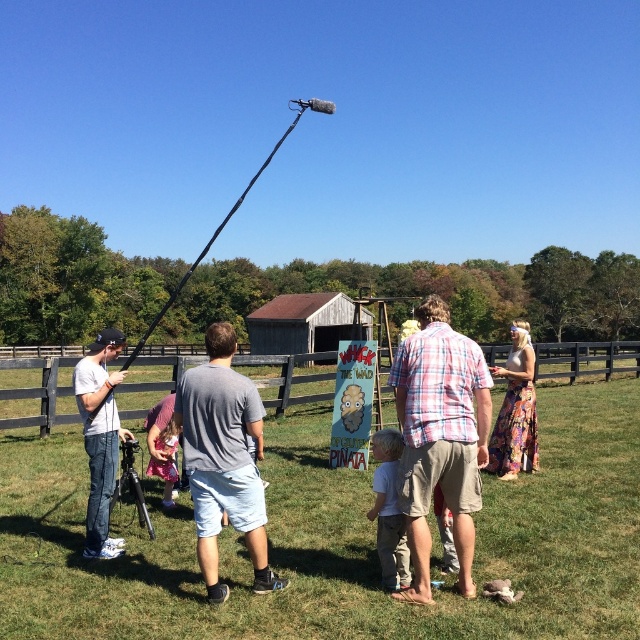
Is gray cotton t-shirt at center bigger than floral dress at center?

No, gray cotton t-shirt at center is not bigger than floral dress at center.

Which is in front, point (204, 573) or point (524, 332)?

Positioned in front is point (204, 573).

You are a GUI agent. You are given a task and a screenshot of the screen. Output one action in this format:
    pyautogui.click(x=<x>, y=<y>)
    Task: Click on the gray cotton t-shirt at center
    This screenshot has width=640, height=640.
    Given the screenshot: What is the action you would take?
    pyautogui.click(x=224, y=460)

Can you confirm if floral dress at center is positioned to the right of light gray cotton shirt at center?

Correct, you'll find floral dress at center to the right of light gray cotton shirt at center.

Which of these two, floral dress at center or light gray cotton shirt at center, stands shorter?

light gray cotton shirt at center is shorter.

This screenshot has height=640, width=640. Identify the location of floral dress at center. (515, 412).

Locate an element on the screen. floral dress at center is located at coordinates (515, 412).

Who is positioned more to the left, light gray cotton shirt at center or black matte tripod at lower left?

black matte tripod at lower left is more to the left.

Between light gray cotton shirt at center and black matte tripod at lower left, which one is positioned higher?

Positioned higher is light gray cotton shirt at center.

Identify the location of light gray cotton shirt at center. The image size is (640, 640). (388, 512).

You are a GUI agent. You are given a task and a screenshot of the screen. Output one action in this format:
    pyautogui.click(x=<x>, y=<y>)
    Task: Click on the light gray cotton shirt at center
    This screenshot has width=640, height=640.
    Given the screenshot: What is the action you would take?
    pyautogui.click(x=388, y=512)